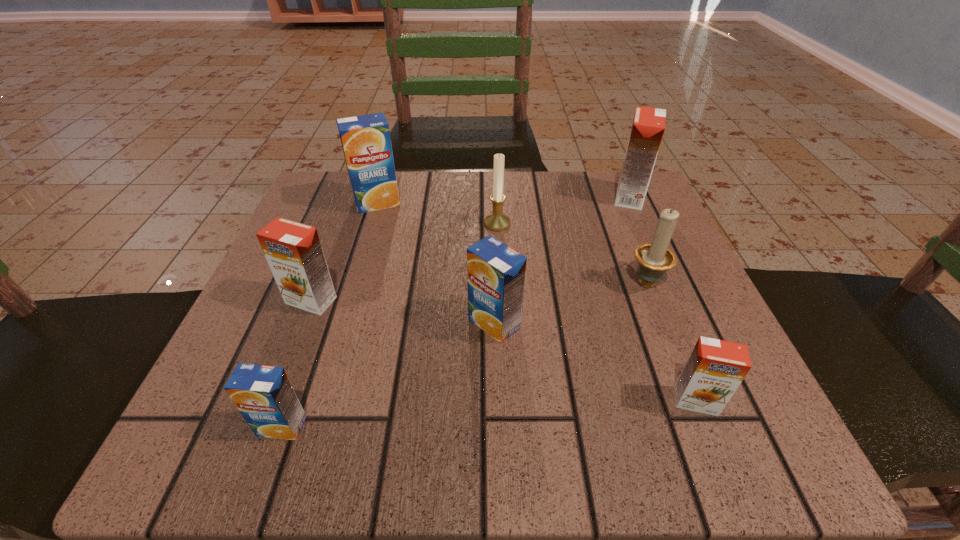
Identify the location of the smallest blue orange_juice. The width and height of the screenshot is (960, 540). (263, 394).

In order to click on free space located on the right of the biggest blue orange_juice in this screenshot , I will do `click(514, 203)`.

Identify the location of vacant area situated 0.110m on the front of the farthest orange orange juice. (650, 244).

This screenshot has height=540, width=960. What are the coordinates of `free region located on the right of the left candle_holder` in the screenshot? It's located at (630, 224).

The width and height of the screenshot is (960, 540). Find the location of `vacant space located on the handle side of the nearer candle_holder`. vacant space located on the handle side of the nearer candle_holder is located at coordinates (607, 183).

In order to click on free point located on the handle side of the nearer candle_holder in this screenshot , I will do pyautogui.click(x=606, y=180).

Identify the location of free point located on the handle side of the nearer candle_holder. (616, 207).

This screenshot has width=960, height=540. Find the location of `free space located 0.090m on the front of the second biggest orange orange juice`. free space located 0.090m on the front of the second biggest orange orange juice is located at coordinates (287, 362).

The width and height of the screenshot is (960, 540). In order to click on vacant area situated 0.260m on the left of the second biggest blue orange_juice in this screenshot , I will do `click(302, 323)`.

Image resolution: width=960 pixels, height=540 pixels. Find the location of `free space located on the left of the nearest orange orange juice`. free space located on the left of the nearest orange orange juice is located at coordinates (510, 401).